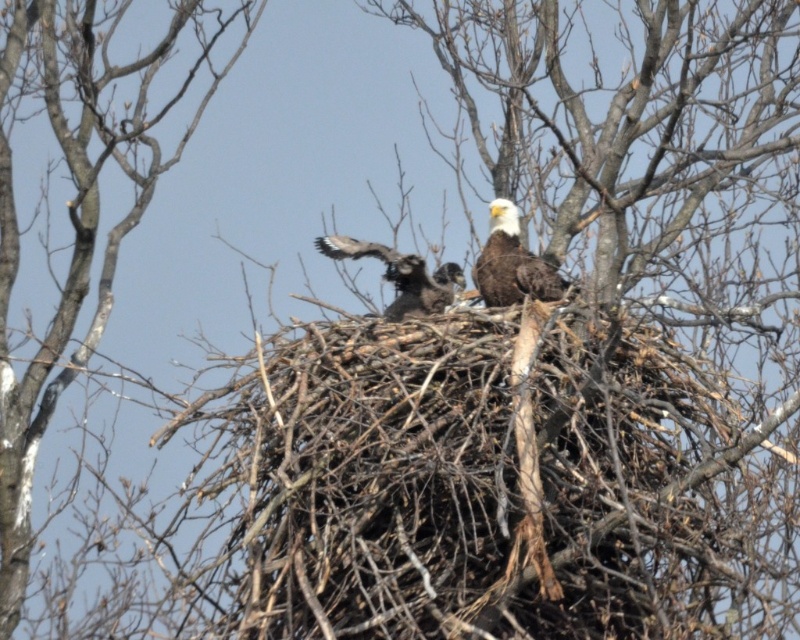
Question: Which point appears closest to the camera in this image?

Choices:
 (A) (12, 424)
 (B) (540, 268)

Answer: (B)

Question: Can you confirm if white feathered eagle at center is positioned below dark brown feathers at center?

Choices:
 (A) yes
 (B) no

Answer: (B)

Question: Estimate the real-world distances between objects in this image. Which object is closer to the dark brown feathers at center?

Choices:
 (A) white feathered eagle at center
 (B) bare branches at center

Answer: (A)

Question: Can you confirm if bare branches at center is positioned below white feathered eagle at center?

Choices:
 (A) no
 (B) yes

Answer: (A)

Question: Is white feathered eagle at center to the left of dark brown feathers at center from the viewer's perspective?

Choices:
 (A) yes
 (B) no

Answer: (B)

Question: Among these points, which one is farthest from the camera?

Choices:
 (A) (88, 202)
 (B) (440, 300)
 (C) (494, 276)

Answer: (A)